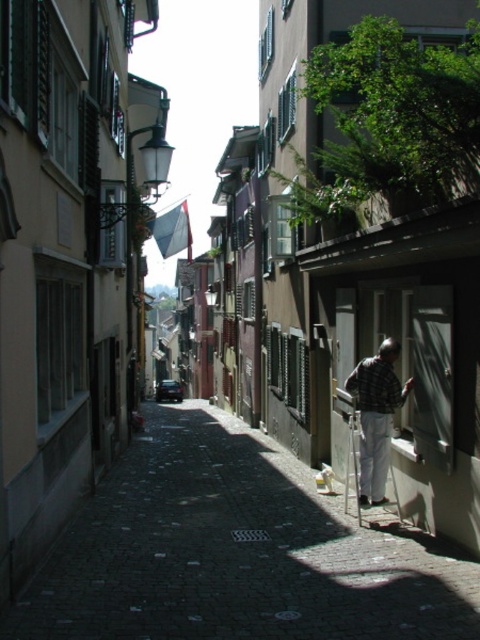
You are a delivery person trying to navigate a narrow cobblestone street in a European city. You see a smooth cobblestone street at center and a metallic silver ladder at lower right. Which one has a greater width?

The smooth cobblestone street at center is wider than the metallic silver ladder at lower right.

You are a delivery drone flying over a narrow cobblestone street flanked by buildings on both sides. You need to land precisely on the smooth cobblestone street at center. What are the coordinates where you should aim to land?

The smooth cobblestone street at center is located at coordinates point (236, 552), so you should aim for that point to land.

You are a tourist walking down the narrow cobblestone street and you want to take a photo of the smooth cobblestone street at center and the checkered fabric shirt at right. Which object should you focus on first to ensure it appears sharp in the photo?

You should focus on the smooth cobblestone street at center first because it is closer to you than the checkered fabric shirt at right, so focusing on it will keep it sharp while the background may blur.